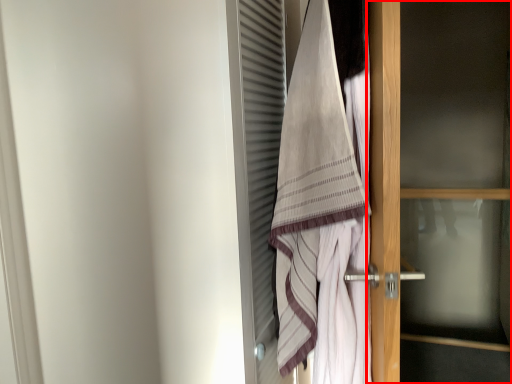
Question: In this image, where is door (annotated by the red box) located relative to towel?

Choices:
 (A) right
 (B) left

Answer: (A)